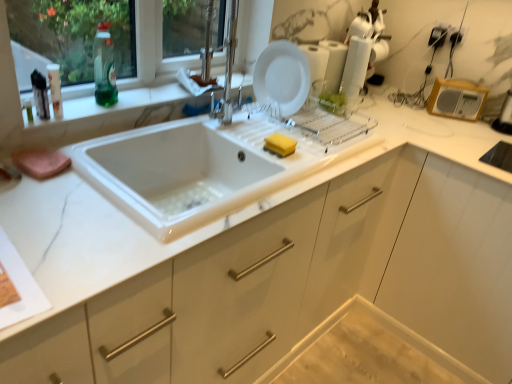
Question: Which direction should I rotate to look at white glossy plate at upper center, the first appliance positioned from the left, — up or down?

Choices:
 (A) down
 (B) up

Answer: (B)

Question: Is translucent plastic bottle at upper left, the 2th bottle viewed from the back, smaller than marble-like white at left?

Choices:
 (A) no
 (B) yes

Answer: (B)

Question: Is translucent plastic bottle at upper left, which is the 1th bottle in front-to-back order, at the right side of marble-like white at left?

Choices:
 (A) no
 (B) yes

Answer: (A)

Question: Can you confirm if translucent plastic bottle at upper left, arranged as the second bottle when viewed from the right, is bigger than marble-like white at left?

Choices:
 (A) yes
 (B) no

Answer: (B)

Question: Is translucent plastic bottle at upper left, the 2th bottle viewed from the back, positioned far away from marble-like white at left?

Choices:
 (A) no
 (B) yes

Answer: (A)

Question: Is translucent plastic bottle at upper left, the 2th bottle viewed from the back, to the left of marble-like white at left from the viewer's perspective?

Choices:
 (A) yes
 (B) no

Answer: (A)

Question: Can you confirm if translucent plastic bottle at upper left, arranged as the second bottle when viewed from the right, is wider than marble-like white at left?

Choices:
 (A) yes
 (B) no

Answer: (B)

Question: Is yellow sponge at sink outside of white glossy plate at upper center, the first appliance positioned from the left?

Choices:
 (A) yes
 (B) no

Answer: (A)

Question: Could you tell me if yellow sponge at sink is turned towards white glossy plate at upper center, the first appliance positioned from the left?

Choices:
 (A) no
 (B) yes

Answer: (A)

Question: From a real-world perspective, is yellow sponge at sink located beneath white glossy plate at upper center, which is the second appliance from right to left?

Choices:
 (A) yes
 (B) no

Answer: (A)

Question: From a real-world perspective, is yellow sponge at sink located higher than white glossy plate at upper center, which is the second appliance from right to left?

Choices:
 (A) yes
 (B) no

Answer: (B)

Question: Is yellow sponge at sink not near white glossy plate at upper center, which is the second appliance from right to left?

Choices:
 (A) no
 (B) yes

Answer: (A)

Question: Does yellow sponge at sink have a larger size compared to white glossy plate at upper center, the first appliance positioned from the left?

Choices:
 (A) no
 (B) yes

Answer: (A)

Question: Are wooden radio at upper right, marked as the first appliance in a right-to-left arrangement, and green translucent bottle at upper left, the 1th bottle viewed from the back, far apart?

Choices:
 (A) no
 (B) yes

Answer: (B)